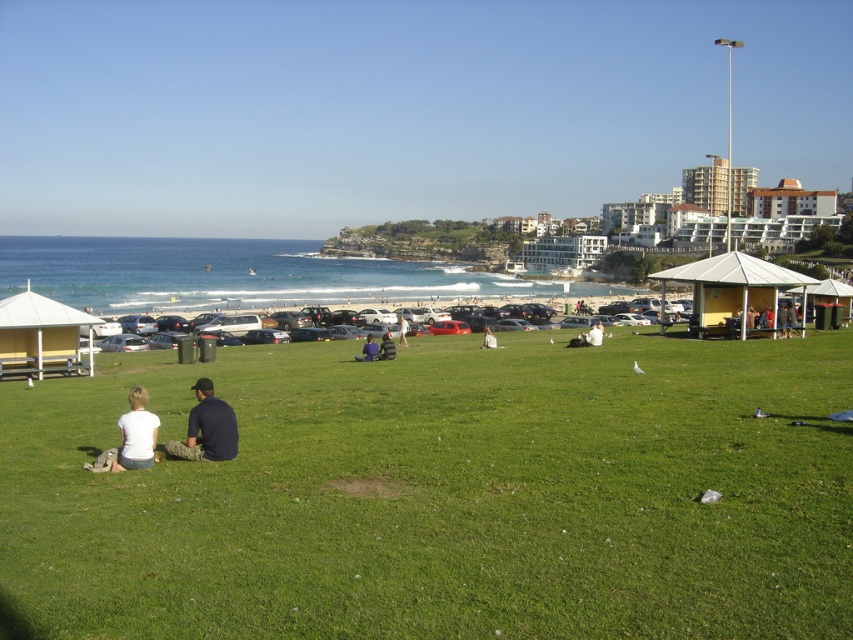
Based on the photo, you are a photographer setting up a tripod to capture the coastal scene. You notice the white fabric person at lower center and the light blue denim shorts at center. Which object should you adjust your camera angle to avoid blocking the other?

The white fabric person at lower center might be wider than the light blue denim shorts at center, so adjusting the camera angle to avoid the wider white fabric person at lower center would prevent it from blocking the light blue denim shorts at center.

You are a photographer trying to capture a group photo of the dark blue shirt at center and the white fabric person at lower center. Since you want to ensure both subjects are in focus, you need to know which one is closer to the camera. Can you determine which person is nearer to the camera based on their sizes?

The dark blue shirt at center is thinner than the white fabric person at lower center, which suggests the dark blue shirt at center is farther away from the camera since thinner objects appear smaller when they are at a distance.